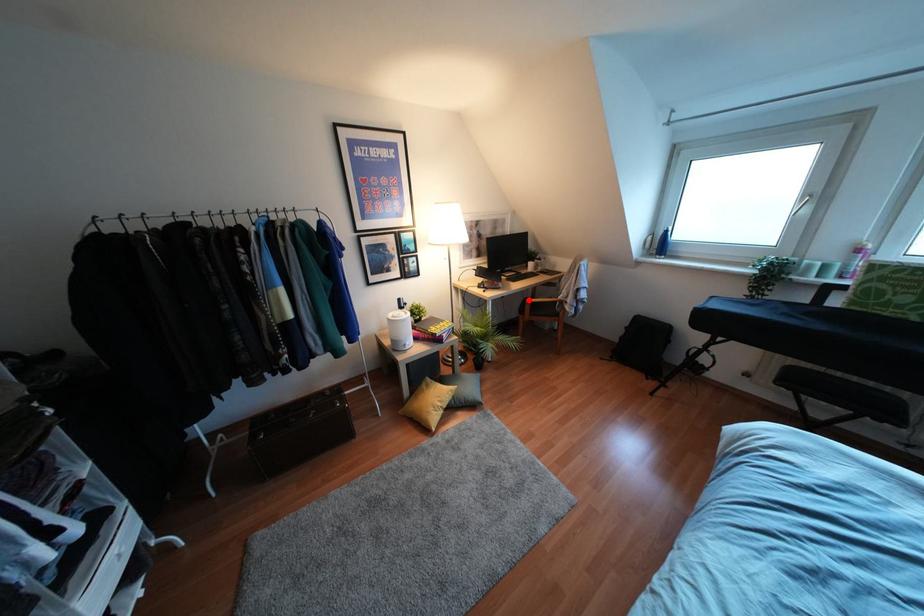
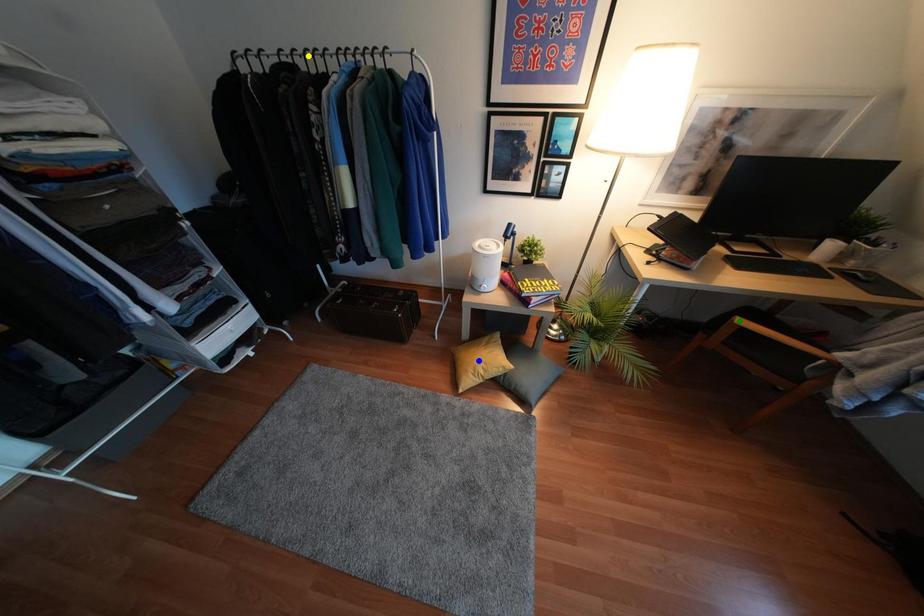
Question: I am providing you with two images of the same scene from different viewpoints. A red point is marked on the first image. You are given multiple points on the second image. Which mark in image 2 goes with the point in image 1?

Choices:
 (A) blue point
 (B) yellow point
 (C) green point

Answer: (C)